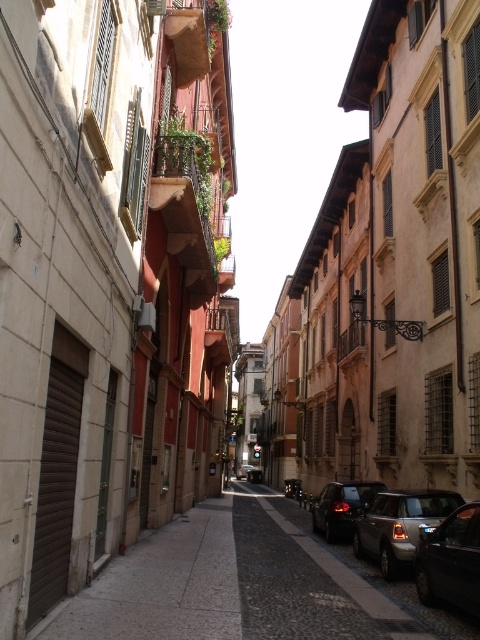
Is shiny black car at lower right closer to the viewer compared to shiny black car at center?

Yes, it is.

Between shiny black car at lower right and shiny black car at center, which one appears on the right side from the viewer's perspective?

Positioned to the right is shiny black car at center.

Where is `shiny black car at lower right`? This screenshot has height=640, width=480. shiny black car at lower right is located at coordinates (451, 561).

You are a GUI agent. You are given a task and a screenshot of the screen. Output one action in this format:
    pyautogui.click(x=<x>, y=<y>)
    Task: Click on the shiny black car at lower right
    The height and width of the screenshot is (640, 480).
    Given the screenshot: What is the action you would take?
    pyautogui.click(x=451, y=561)

Is cobblestone pavement at center positioned before shiny black car at center?

Yes.

Can you confirm if cobblestone pavement at center is positioned above shiny black car at center?

Correct, cobblestone pavement at center is located above shiny black car at center.

Describe the element at coordinates (247, 584) in the screenshot. I see `cobblestone pavement at center` at that location.

Identify the location of cobblestone pavement at center. (247, 584).

Who is more distant from viewer, (471,576) or (242,470)?

Positioned behind is point (242,470).

Which is below, shiny black car at lower right or metallic silver car at center?

metallic silver car at center is lower down.

Which is behind, point (427, 545) or point (247, 470)?

Point (247, 470)

What are the coordinates of `shiny black car at lower right` in the screenshot? It's located at [451, 561].